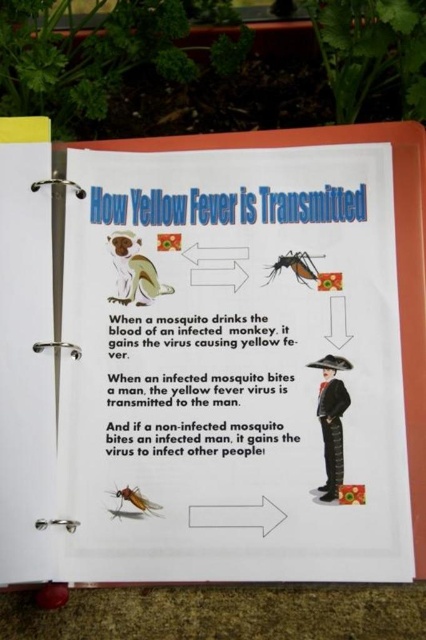
Does point (314, 280) come in front of point (138, 513)?

No, (314, 280) is behind (138, 513).

Does translucent white mosquito at center have a lesser height compared to translucent brown mosquito at center?

No, translucent white mosquito at center is not shorter than translucent brown mosquito at center.

In order to click on translucent white mosquito at center in this screenshot , I will do `click(294, 266)`.

Does white paper at center appear on the right side of translucent white mosquito at center?

In fact, white paper at center is to the left of translucent white mosquito at center.

What do you see at coordinates (213, 356) in the screenshot? The height and width of the screenshot is (640, 426). I see `white paper at center` at bounding box center [213, 356].

Does point (206, 246) lie in front of point (282, 260)?

No, it is behind (282, 260).

The image size is (426, 640). What are the coordinates of `white paper at center` in the screenshot? It's located at (213, 356).

Is brown fur monkey at upper left to the left of translucent brown mosquito at center from the viewer's perspective?

Indeed, brown fur monkey at upper left is positioned on the left side of translucent brown mosquito at center.

Who is more distant from viewer, (138, 262) or (132, 500)?

Positioned behind is point (138, 262).

Find the location of `brown fur monkey at upper left`. brown fur monkey at upper left is located at coordinates (134, 272).